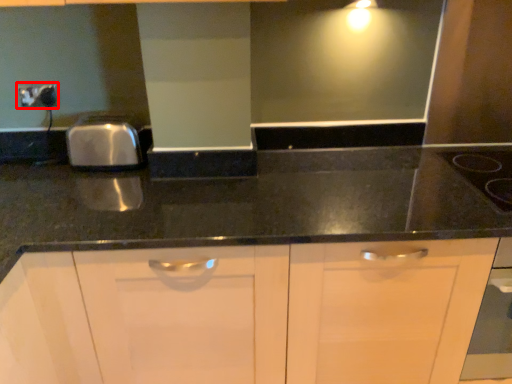
Question: From the image's perspective, considering the relative positions of electric outlet (annotated by the red box) and gas stove in the image provided, where is electric outlet (annotated by the red box) located with respect to the staircase?

Choices:
 (A) above
 (B) below

Answer: (A)